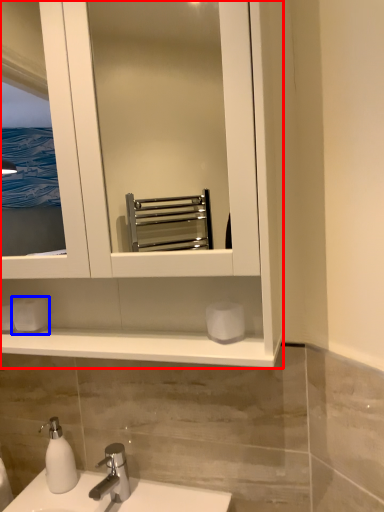
Question: Which object appears farthest to the camera in this image, bathroom cabinet (highlighted by a red box) or toilet paper (highlighted by a blue box)?

Choices:
 (A) bathroom cabinet
 (B) toilet paper

Answer: (B)